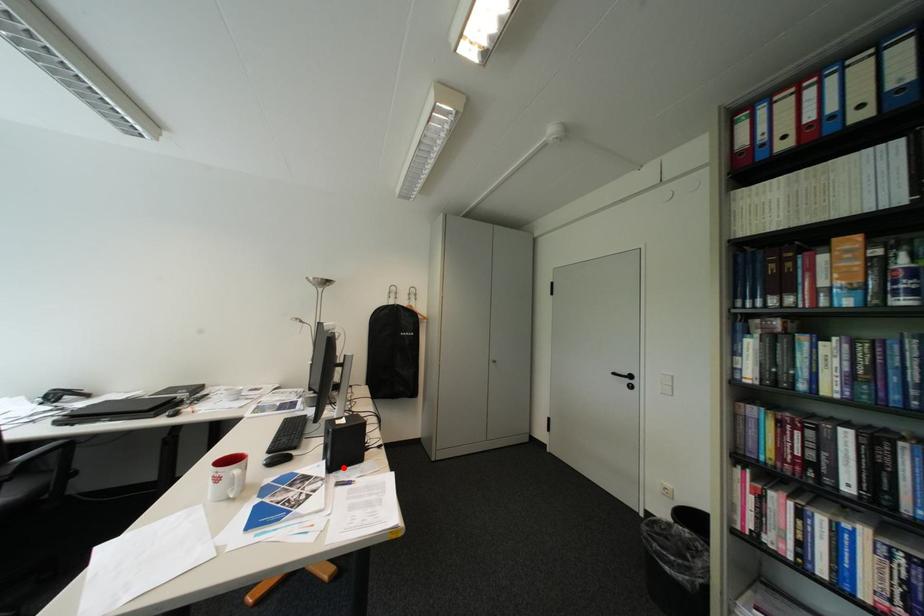
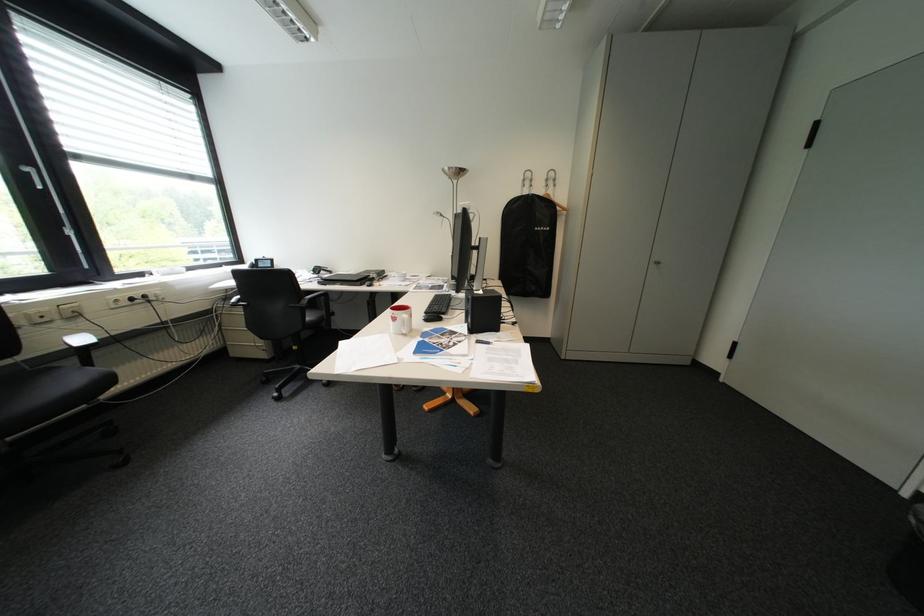
Locate, in the second image, the point that corresponds to the highlighted location in the first image.

(484, 331)